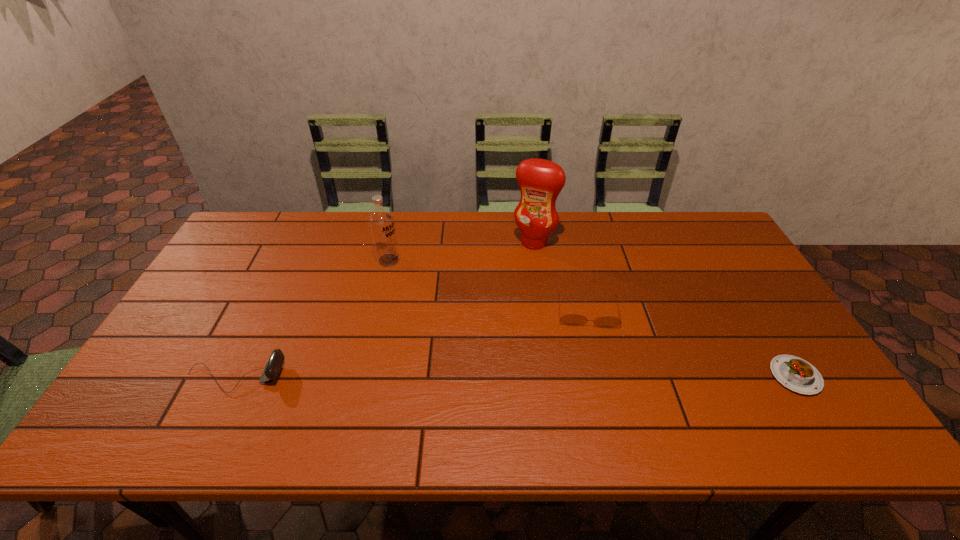
Identify the location of blank space located on the label side of the farthest object. This screenshot has height=540, width=960. (516, 271).

Find the location of `free space located on the label side of the farthest object`. free space located on the label side of the farthest object is located at coordinates (516, 271).

Image resolution: width=960 pixels, height=540 pixels. I want to click on free region located on the face of the sunglasses, so click(595, 386).

Identify the location of vacant point located on the face of the sunglasses. (594, 375).

This screenshot has height=540, width=960. I want to click on blank space located 0.220m on the face of the sunglasses, so click(x=597, y=400).

I want to click on free space located on the front label of the vodka, so click(x=445, y=295).

This screenshot has width=960, height=540. Find the location of `vacant region located on the front label of the vodka`. vacant region located on the front label of the vodka is located at coordinates (x=474, y=312).

Identify the location of free space located 0.250m on the front label of the vodka. (456, 301).

Where is `condiment present at the far edge`? The height and width of the screenshot is (540, 960). condiment present at the far edge is located at coordinates (540, 181).

In order to click on vodka that is positioned at the far edge in this screenshot , I will do `click(381, 221)`.